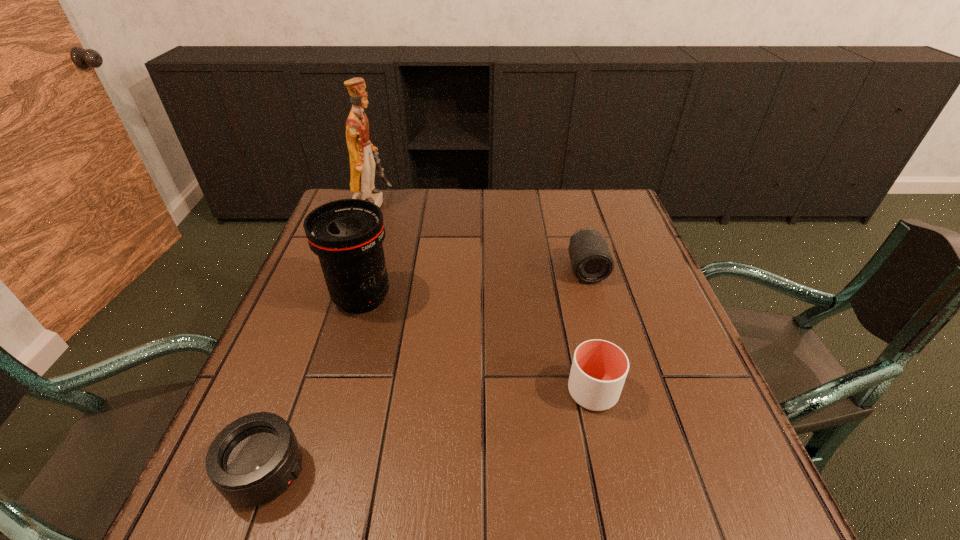
I want to click on vacant area at the left edge, so click(x=319, y=328).

This screenshot has width=960, height=540. I want to click on free space at the right edge of the desktop, so (x=621, y=261).

The width and height of the screenshot is (960, 540). Find the location of `vacant space at the far right corner`. vacant space at the far right corner is located at coordinates (612, 221).

Where is `vacant space at the near right corner of the desktop`? Image resolution: width=960 pixels, height=540 pixels. vacant space at the near right corner of the desktop is located at coordinates (721, 514).

This screenshot has height=540, width=960. Find the location of `free space between the second tallest object and the rightmost telephoto lens`. free space between the second tallest object and the rightmost telephoto lens is located at coordinates (474, 284).

What are the coordinates of `empty location between the rightmost telephoto lens and the fourth shortest object` in the screenshot? It's located at (474, 284).

Locate an element on the screen. The width and height of the screenshot is (960, 540). free space between the rightmost telephoto lens and the tallest object is located at coordinates (479, 236).

Image resolution: width=960 pixels, height=540 pixels. What are the coordinates of `blank region between the cup and the nutcracker` in the screenshot? It's located at (483, 297).

Where is `empty location between the second nearest object and the rightmost telephoto lens`? The height and width of the screenshot is (540, 960). empty location between the second nearest object and the rightmost telephoto lens is located at coordinates (589, 330).

What are the coordinates of `vacant area between the farthest object and the rightmost telephoto lens` in the screenshot? It's located at (479, 236).